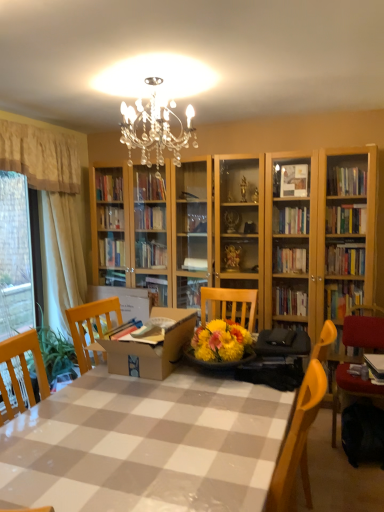
The image size is (384, 512). Find the location of `blank space situated above checkered plastic table at center (from a real-world perspective)`. blank space situated above checkered plastic table at center (from a real-world perspective) is located at coordinates (168, 412).